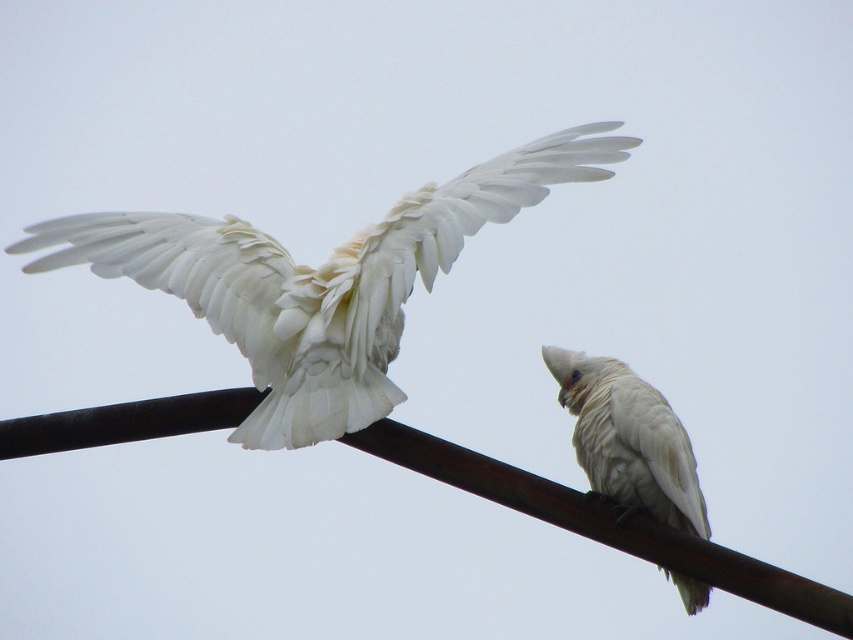
Question: Does white feathered bird at upper left appear on the right side of rusty metal pole at upper center?

Choices:
 (A) no
 (B) yes

Answer: (A)

Question: Which is nearer to the rusty metal pole at upper center?

Choices:
 (A) white feathered bird at upper left
 (B) white feathered parrot at center

Answer: (A)

Question: Considering the relative positions of white feathered bird at upper left and white feathered parrot at center in the image provided, where is white feathered bird at upper left located with respect to white feathered parrot at center?

Choices:
 (A) right
 (B) left

Answer: (B)

Question: Estimate the real-world distances between objects in this image. Which object is farther from the white feathered parrot at center?

Choices:
 (A) rusty metal pole at upper center
 (B) white feathered bird at upper left

Answer: (B)

Question: Is white feathered bird at upper left to the right of rusty metal pole at upper center from the viewer's perspective?

Choices:
 (A) no
 (B) yes

Answer: (A)

Question: Which is nearer to the white feathered parrot at center?

Choices:
 (A) white feathered bird at upper left
 (B) rusty metal pole at upper center

Answer: (B)